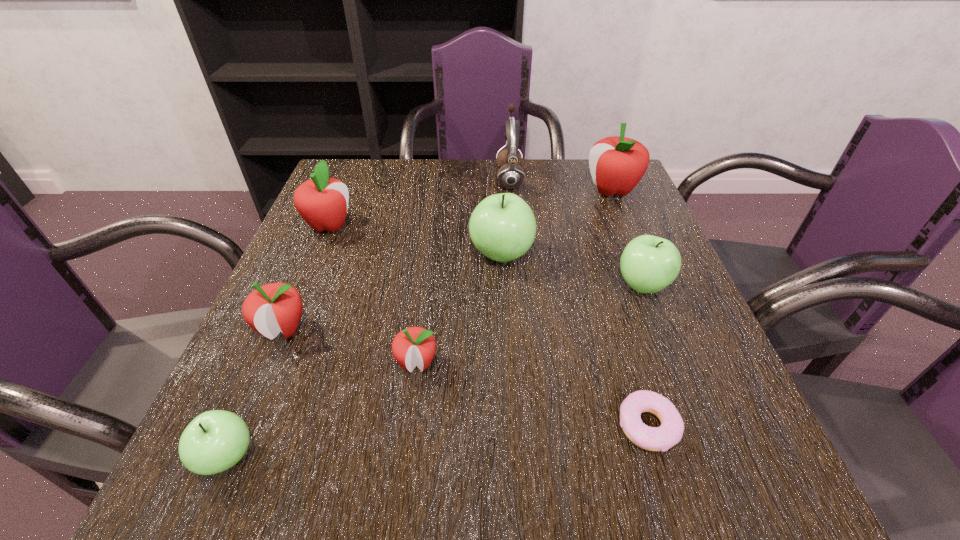
Point out which apple is positioned as the second nearest to the fourth object from left to right. Please provide its 2D coordinates. Your answer should be formatted as a tuple, i.e. [(x, y)], where the tuple contains the x and y coordinates of a point satisfying the conditions above.

[(502, 227)]

Find the location of a particular element. apple that stands as the fourth closest to the second green apple from left to right is located at coordinates (322, 201).

Identify the location of red apple that is the second nearest to the second smallest red apple. The image size is (960, 540). (322, 201).

The image size is (960, 540). What are the coordinates of `the fourth closest red apple to the leftmost green apple` in the screenshot? It's located at (617, 164).

Identify the location of green apple that is the second closest to the earphone. This screenshot has width=960, height=540. (648, 264).

Find the location of a particular element. The image size is (960, 540). green apple that can be found as the second closest to the second farthest red apple is located at coordinates (214, 441).

You are a GUI agent. You are given a task and a screenshot of the screen. Output one action in this format:
    pyautogui.click(x=<x>, y=<y>)
    Task: Click on the blank area in the image that satisfies the following two spatial constraints: 1. on the back side of the rightmost green apple; 2. on the left side of the rightmost red apple
    This screenshot has height=540, width=960.
    Given the screenshot: What is the action you would take?
    pyautogui.click(x=606, y=191)

Find the location of a particular element. free point that satisfies the following two spatial constraints: 1. on the back side of the rightmost red apple; 2. on the ear pads of the earphone is located at coordinates (607, 179).

This screenshot has height=540, width=960. I want to click on vacant position in the image that satisfies the following two spatial constraints: 1. on the back side of the smallest green apple; 2. on the left side of the farthest red apple, so click(x=341, y=191).